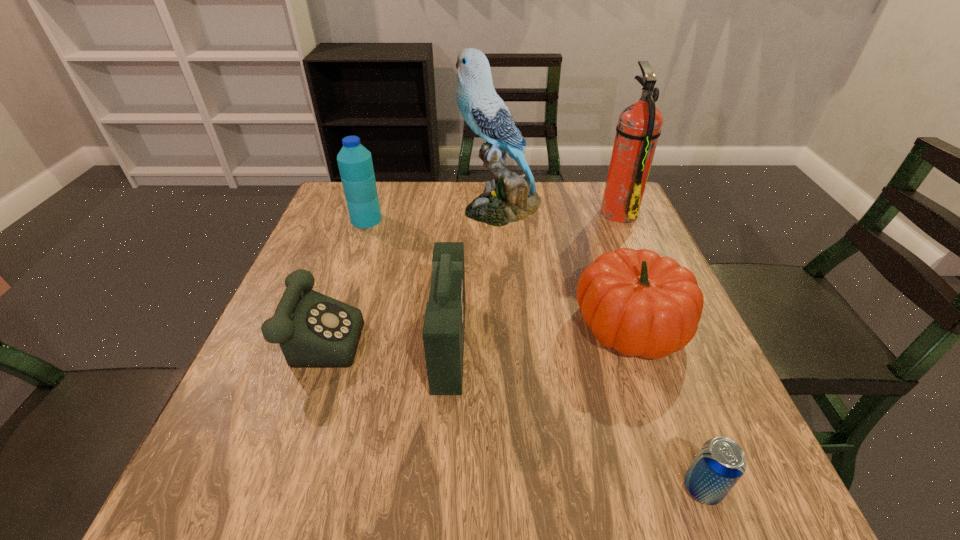
The height and width of the screenshot is (540, 960). Find the location of `fire extinguisher at the far edge`. fire extinguisher at the far edge is located at coordinates (639, 125).

At what (x,y) coordinates should I click in order to perform the action: click on water bottle at the far edge. Please return your answer as a coordinate pair (x, y). The height and width of the screenshot is (540, 960). Looking at the image, I should click on coord(355,164).

You are a GUI agent. You are given a task and a screenshot of the screen. Output one action in this format:
    pyautogui.click(x=<x>, y=<y>)
    Task: Click on the object located in the near edge section of the desktop
    The height and width of the screenshot is (540, 960).
    Given the screenshot: What is the action you would take?
    pyautogui.click(x=720, y=463)

This screenshot has height=540, width=960. Identify the location of water bottle situated at the left edge. (355, 164).

The height and width of the screenshot is (540, 960). I want to click on telephone present at the left edge, so click(313, 330).

You are a GUI agent. You are given a task and a screenshot of the screen. Output one action in this format:
    pyautogui.click(x=<x>, y=<y>)
    Task: Click on the fire extinguisher that is at the right edge
    The height and width of the screenshot is (540, 960).
    Given the screenshot: What is the action you would take?
    pyautogui.click(x=639, y=125)

Find the location of a particular element. This screenshot has width=960, height=540. pumpkin that is at the right edge is located at coordinates (634, 301).

Locate an element on the screen. This screenshot has height=540, width=960. beer can that is at the right edge is located at coordinates (720, 463).

Image resolution: width=960 pixels, height=540 pixels. I want to click on object that is at the far left corner, so click(355, 164).

Image resolution: width=960 pixels, height=540 pixels. Identify the location of object located in the far right corner section of the desktop. (639, 125).